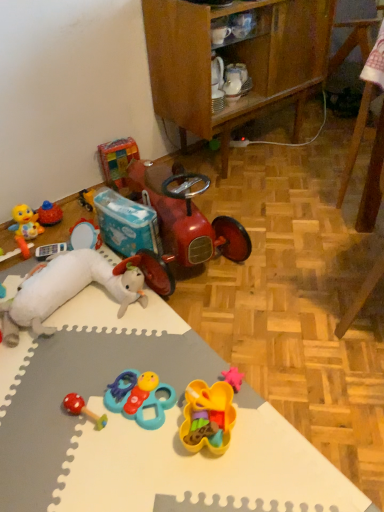
At what (x,y) coordinates should I click in order to perform the action: click on free location in front of rubberized red mushroom rattle at lower left, the 2th toy in the front-to-back sequence. Please return your answer as a coordinate pair (x, y). Looking at the image, I should click on (82, 470).